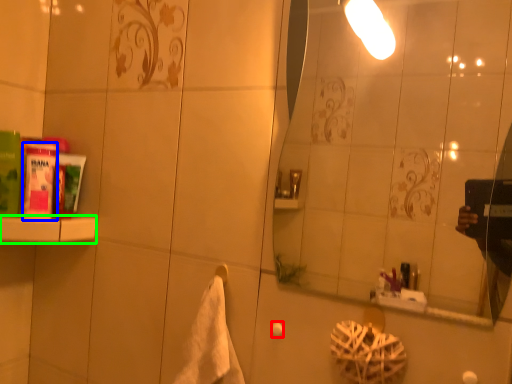
Question: Based on their relative distances, which object is nearer to towel bar (highlighted by a red box)? Choose from mouthwash (highlighted by a blue box) and shelf (highlighted by a green box).

Choices:
 (A) mouthwash
 (B) shelf

Answer: (B)